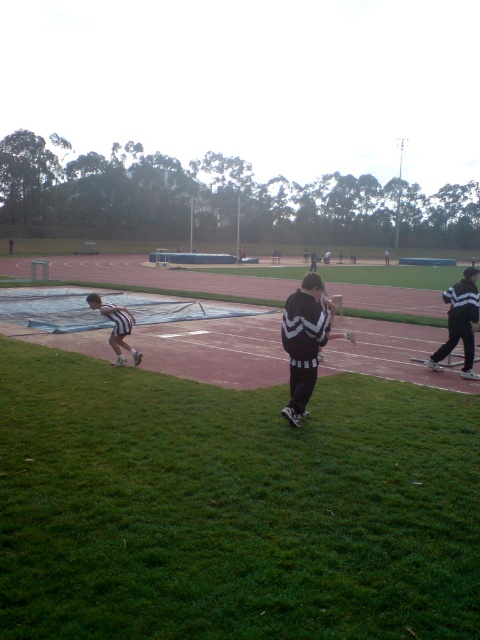
You are a photographer positioned at the center of the field. You want to take a photo that includes both the black and white striped jacket at right and the white athletic shorts at lower left. Which object should you adjust your camera angle to focus on first to ensure both are in frame?

You should focus on the black and white striped jacket at right first since it is closer to the viewer than the white athletic shorts at lower left, so adjusting the angle to include it will naturally bring the shorts into the frame as well.

You are a photographer standing at the edge of the sports field. You want to capture a photo that includes both the green grass at lower left and the black and white striped jacket at right. Which object should you focus on first to ensure both are in sharp focus?

You should focus on the green grass at lower left first because it is closer to the viewer than the black and white striped jacket at right. By focusing on the closer object, the background object will still be in focus due to the depth of field.